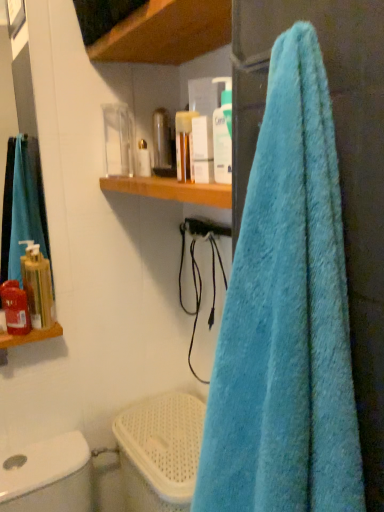
Question: Does blue fluffy towel at right have a greater height compared to matte white container at upper center, placed as the 1th toiletry when sorted from top to bottom?

Choices:
 (A) no
 (B) yes

Answer: (B)

Question: Considering the relative sizes of blue fluffy towel at right and matte white container at upper center, which appears as the fourth toiletry when ordered from the bottom, in the image provided, is blue fluffy towel at right shorter than matte white container at upper center, which appears as the fourth toiletry when ordered from the bottom,?

Choices:
 (A) yes
 (B) no

Answer: (B)

Question: Can you confirm if blue fluffy towel at right is positioned to the left of matte white container at upper center, acting as the first toiletry starting from the back?

Choices:
 (A) yes
 (B) no

Answer: (B)

Question: Is blue fluffy towel at right smaller than matte white container at upper center, acting as the 4th toiletry starting from the front?

Choices:
 (A) yes
 (B) no

Answer: (B)

Question: Considering the relative sizes of blue fluffy towel at right and matte white container at upper center, placed as the second toiletry when sorted from right to left, in the image provided, is blue fluffy towel at right bigger than matte white container at upper center, placed as the second toiletry when sorted from right to left,?

Choices:
 (A) yes
 (B) no

Answer: (A)

Question: Would you say wooden shelf at upper center is inside or outside matte red soap dispenser at left, which is the 2th toiletry from front to back?

Choices:
 (A) inside
 (B) outside

Answer: (B)

Question: Is point [x=195, y=34] closer or farther from the camera than point [x=8, y=331]?

Choices:
 (A) farther
 (B) closer

Answer: (B)

Question: From the image's perspective, is wooden shelf at upper center positioned above or below matte red soap dispenser at left, which is counted as the third toiletry, starting from the back?

Choices:
 (A) above
 (B) below

Answer: (A)

Question: In terms of size, does wooden shelf at upper center appear bigger or smaller than matte red soap dispenser at left, arranged as the fourth toiletry when viewed from the top?

Choices:
 (A) small
 (B) big

Answer: (B)

Question: From the image's perspective, is matte white container at upper center, which appears as the fourth toiletry when ordered from the bottom, located above or below white plastic toilet bowl at lower left?

Choices:
 (A) below
 (B) above

Answer: (B)

Question: Relative to white plastic toilet bowl at lower left, is matte white container at upper center, acting as the first toiletry starting from the back, in front or behind?

Choices:
 (A) behind
 (B) front

Answer: (A)

Question: Based on their sizes in the image, would you say matte white container at upper center, acting as the 4th toiletry starting from the front, is bigger or smaller than white plastic toilet bowl at lower left?

Choices:
 (A) big
 (B) small

Answer: (B)

Question: Is point (137, 169) closer or farther from the camera than point (185, 449)?

Choices:
 (A) closer
 (B) farther

Answer: (B)

Question: Is matte red soap dispenser at left, placed as the 1th toiletry when sorted from left to right, to the left or to the right of wooden shelf at upper center in the image?

Choices:
 (A) right
 (B) left

Answer: (B)

Question: In terms of height, does matte red soap dispenser at left, placed as the 1th toiletry when sorted from left to right, look taller or shorter compared to wooden shelf at upper center?

Choices:
 (A) short
 (B) tall

Answer: (B)